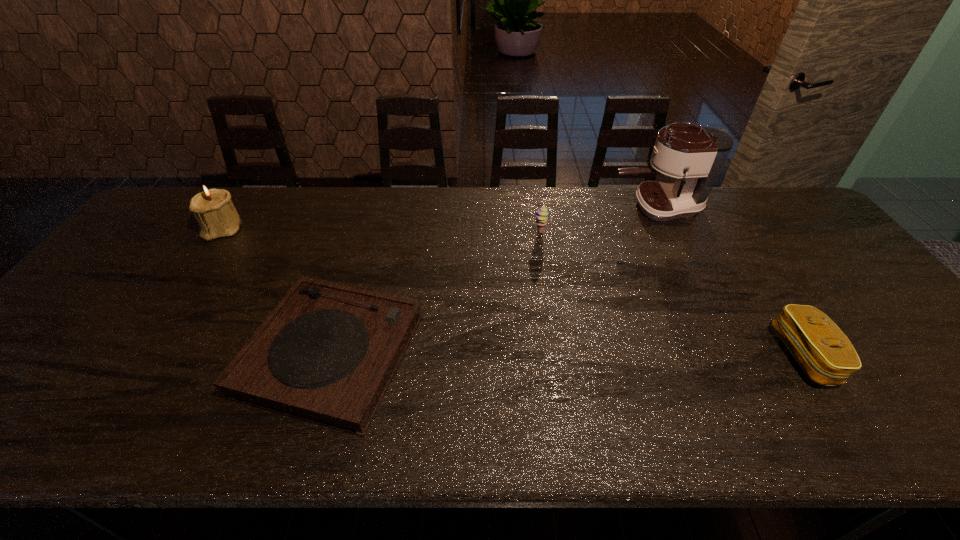
This screenshot has height=540, width=960. I want to click on the tallest object, so click(x=694, y=155).

Where is `the second tallest object`? the second tallest object is located at coordinates (213, 210).

The height and width of the screenshot is (540, 960). I want to click on candle_holder, so click(213, 210).

The height and width of the screenshot is (540, 960). What are the coordinates of `sherbert` in the screenshot? It's located at (541, 215).

Find the location of a particular element. clutch bag is located at coordinates (825, 354).

Image resolution: width=960 pixels, height=540 pixels. I want to click on the shortest object, so click(327, 353).

At what (x,y) coordinates should I click in order to perform the action: click on phonograph record. Please return your answer as a coordinate pair (x, y). The height and width of the screenshot is (540, 960). Looking at the image, I should click on (327, 353).

Locate an element on the screen. This screenshot has height=540, width=960. free space located 0.330m on the front-facing side of the tallest object is located at coordinates (510, 207).

Find the location of a particular element. This screenshot has width=960, height=540. blank space located on the front-facing side of the tallest object is located at coordinates (579, 207).

Where is `vacant space situated 0.090m on the front-facing side of the tallest object`? vacant space situated 0.090m on the front-facing side of the tallest object is located at coordinates (583, 207).